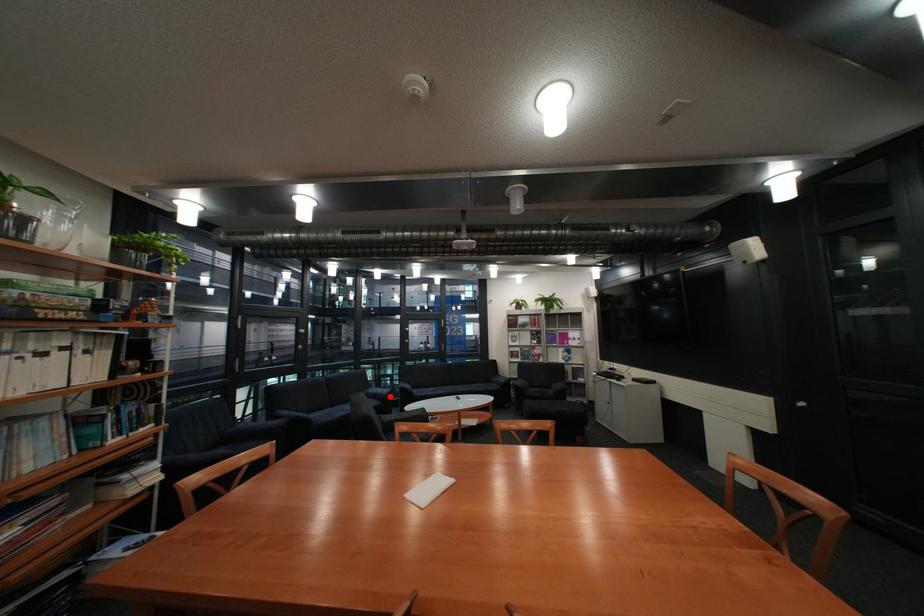
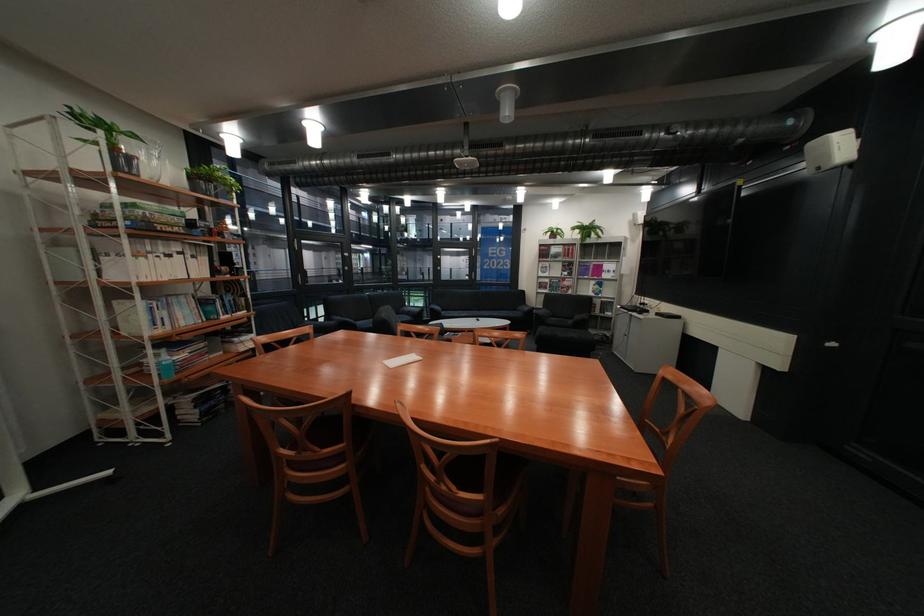
Locate, in the second image, the point that corresponds to the highlighted location in the first image.

(423, 313)